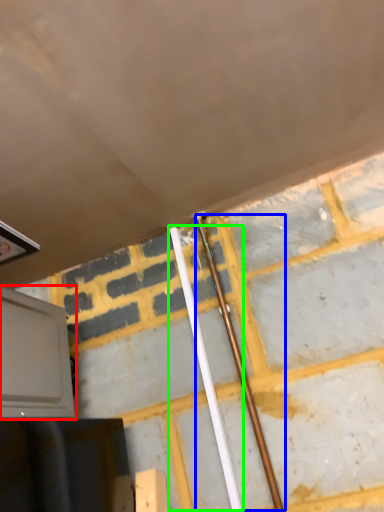
Question: Which object is the closest to the oven (highlighted by a red box)? Choose among these: beam (highlighted by a blue box) or beam (highlighted by a green box).

Choices:
 (A) beam
 (B) beam

Answer: (B)